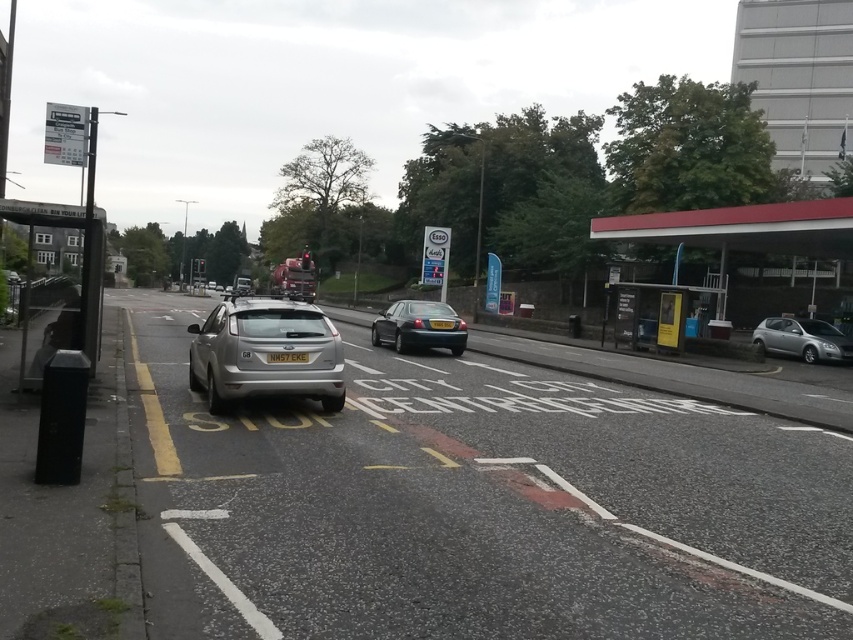
You are a pedestrian standing at the bus stop shelter and want to cross the road to reach the point labeled as point (831, 358) and point (291, 360). Which point should you head towards if you want to go to the one that is further away from the bus stop?

You should head towards point (831, 358) because it is behind point (291, 360), meaning it is farther away from the bus stop.

You are a pedestrian waiting at the bus stop. You see a silver metallic hatchback at center and a silver metallic hatchback at right. Which car is closer to the ground?

The silver metallic hatchback at center is closer to the ground because it is below the silver metallic hatchback at right.